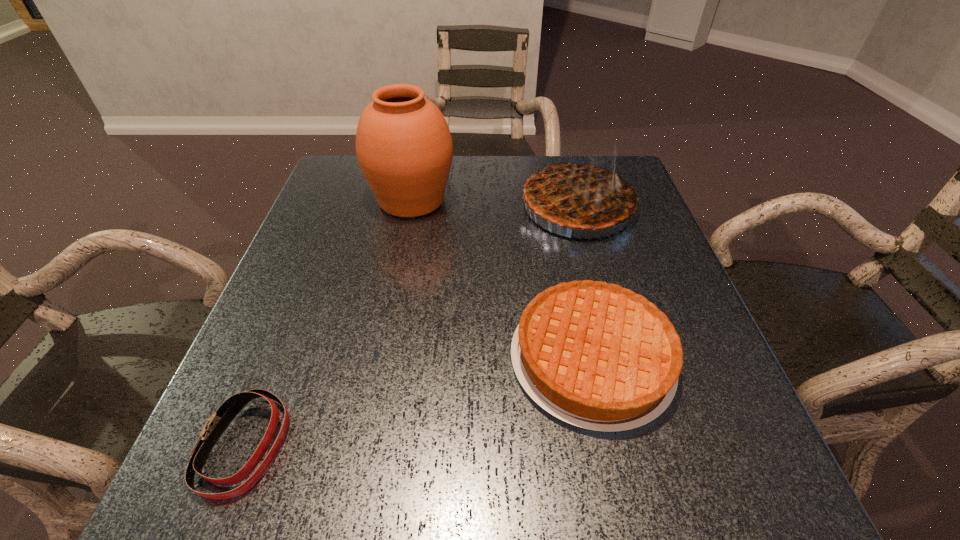
Locate an element on the screen. Image resolution: width=960 pixels, height=540 pixels. the tallest object is located at coordinates (404, 148).

This screenshot has width=960, height=540. I want to click on urn, so click(404, 148).

Identify the location of the third shortest object. Image resolution: width=960 pixels, height=540 pixels. (577, 194).

You are a GUI agent. You are given a task and a screenshot of the screen. Output one action in this format:
    pyautogui.click(x=<x>, y=<y>)
    Task: Click on the taller pie
    
    Given the screenshot: What is the action you would take?
    pyautogui.click(x=577, y=194)

You are a GUI agent. You are given a task and a screenshot of the screen. Output one action in this format:
    pyautogui.click(x=<x>, y=<y>)
    Task: Click on the second shortest object
    The height and width of the screenshot is (540, 960).
    Given the screenshot: What is the action you would take?
    pyautogui.click(x=596, y=355)

Find the location of a particular element. The width and height of the screenshot is (960, 540). the shorter pie is located at coordinates (596, 355).

Locate an element on the screen. Image resolution: width=960 pixels, height=540 pixels. dog collar is located at coordinates (218, 422).

Where is `the shortest object`? the shortest object is located at coordinates (218, 422).

Identify the location of free space located 0.100m on the right of the third object from right to left. The height and width of the screenshot is (540, 960). (494, 200).

Identify the location of vacant space located 0.400m on the front of the third shortest object. This screenshot has height=540, width=960. (630, 400).